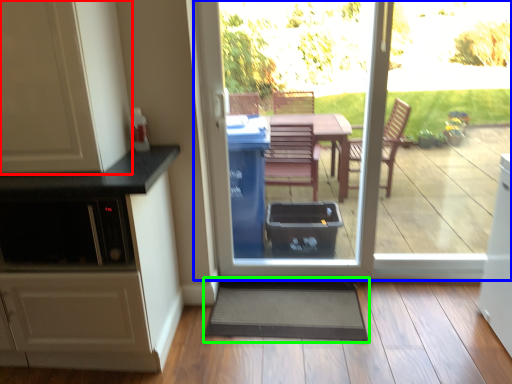
Question: Which object is the farthest from cabinetry (highlighted by a red box)? Choose among these: door (highlighted by a blue box) or doormat (highlighted by a green box).

Choices:
 (A) door
 (B) doormat

Answer: (B)